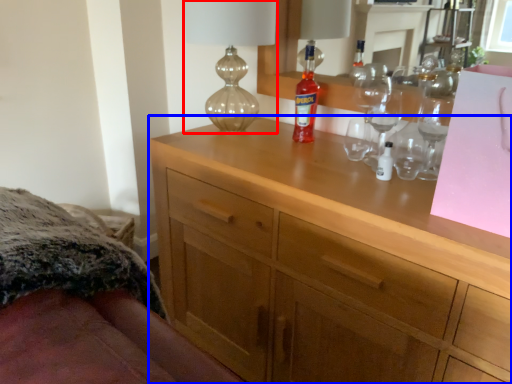
Question: Among these objects, which one is farthest to the camera, table lamp (highlighted by a red box) or chest of drawers (highlighted by a blue box)?

Choices:
 (A) table lamp
 (B) chest of drawers

Answer: (A)